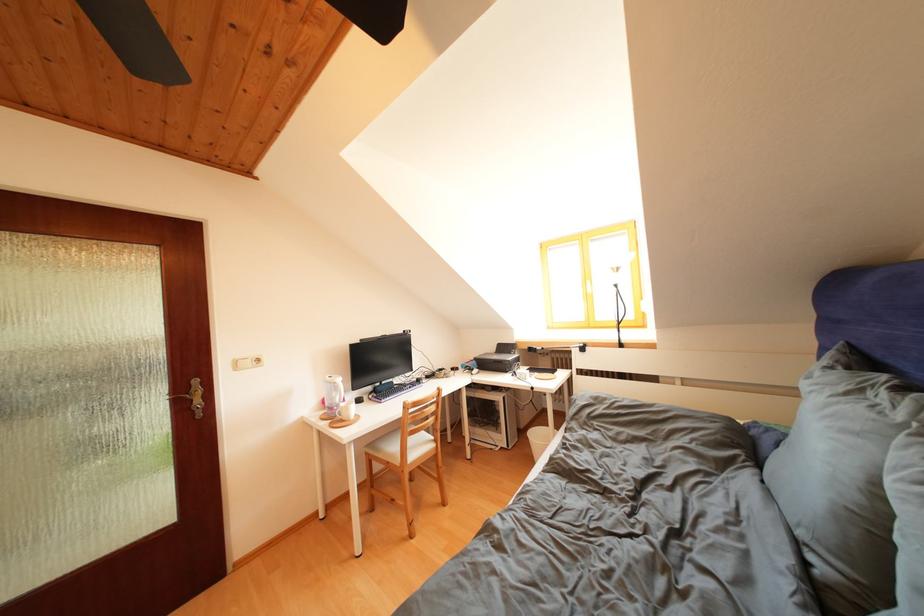
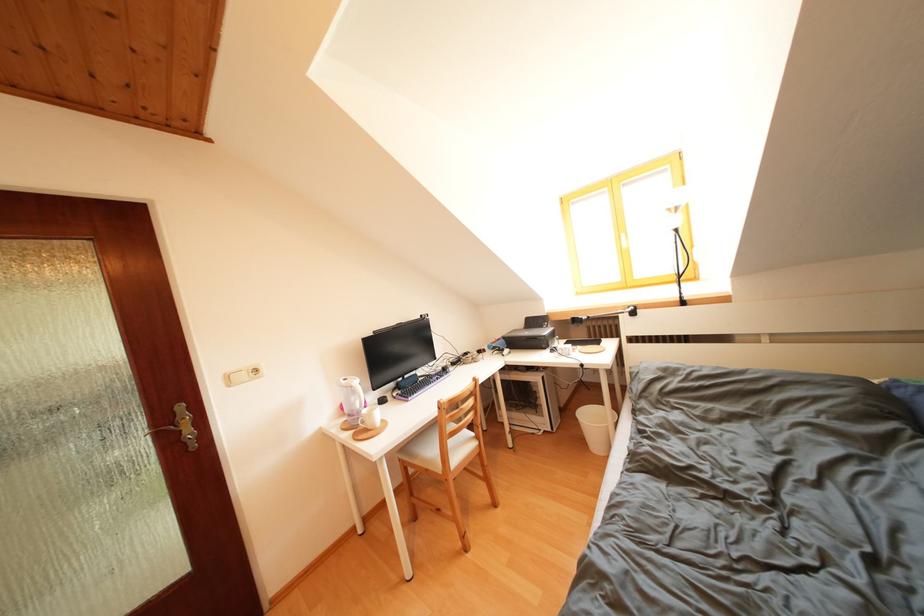
Question: How did the camera likely rotate?

Choices:
 (A) Left
 (B) Right
 (C) Up
 (D) Down

Answer: (D)